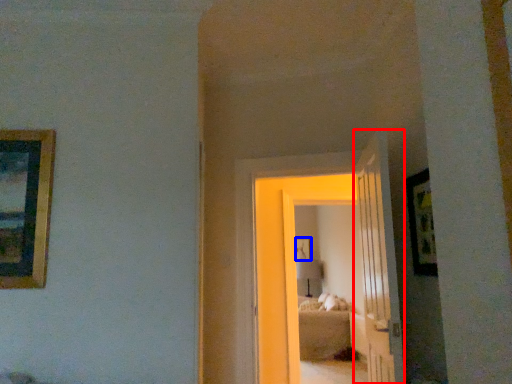
Question: Which point is further to the camera, door (highlighted by a red box) or picture frame (highlighted by a blue box)?

Choices:
 (A) door
 (B) picture frame

Answer: (B)